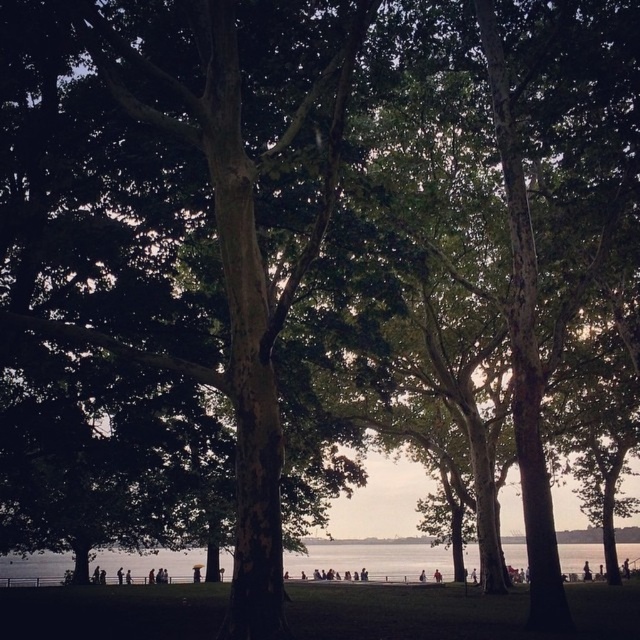
Question: Is clear water at lower center below light brown wooden stick at center?

Choices:
 (A) no
 (B) yes

Answer: (A)

Question: Which of the following is the farthest from the observer?

Choices:
 (A) clear water at lower center
 (B) light brown wooden stick at center

Answer: (B)

Question: Can you confirm if clear water at lower center is bigger than light brown wooden stick at center?

Choices:
 (A) no
 (B) yes

Answer: (B)

Question: Is clear water at lower center bigger than light brown wooden stick at center?

Choices:
 (A) yes
 (B) no

Answer: (A)